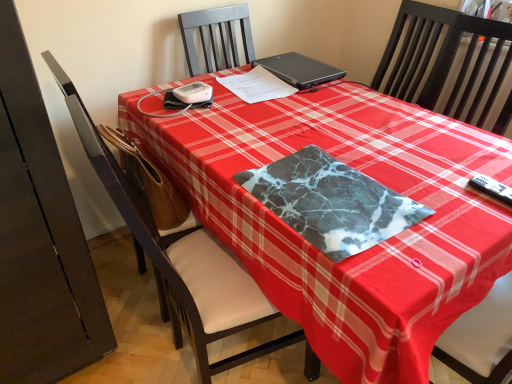
Question: Is black matte laptop at upper center a part of marble-like fabric at center?

Choices:
 (A) yes
 (B) no

Answer: (B)

Question: Is marble-like fabric at center oriented towards black matte laptop at upper center?

Choices:
 (A) no
 (B) yes

Answer: (A)

Question: Is marble-like fabric at center oriented away from black matte laptop at upper center?

Choices:
 (A) yes
 (B) no

Answer: (B)

Question: Does marble-like fabric at center have a lesser height compared to black matte laptop at upper center?

Choices:
 (A) yes
 (B) no

Answer: (A)

Question: Does marble-like fabric at center have a greater width compared to black matte laptop at upper center?

Choices:
 (A) no
 (B) yes

Answer: (A)

Question: Is black plastic remote control at lower right bigger or smaller than black wood chair at center?

Choices:
 (A) small
 (B) big

Answer: (A)

Question: In the image, is black plastic remote control at lower right on the left side or the right side of black wood chair at center?

Choices:
 (A) left
 (B) right

Answer: (A)

Question: From the image's perspective, relative to black wood chair at center, is black plastic remote control at lower right above or below?

Choices:
 (A) below
 (B) above

Answer: (A)

Question: Which is correct: black plastic remote control at lower right is inside black wood chair at center, or outside of it?

Choices:
 (A) inside
 (B) outside

Answer: (B)

Question: From the image's perspective, relative to black plastic remote control at lower right, is white paper at center above or below?

Choices:
 (A) above
 (B) below

Answer: (A)

Question: Is white paper at center situated inside black plastic remote control at lower right or outside?

Choices:
 (A) inside
 (B) outside

Answer: (B)

Question: From a real-world perspective, is white paper at center above or below black plastic remote control at lower right?

Choices:
 (A) above
 (B) below

Answer: (A)

Question: Looking at the image, does white paper at center seem bigger or smaller compared to black plastic remote control at lower right?

Choices:
 (A) big
 (B) small

Answer: (A)

Question: From the image's perspective, relative to marble-like fabric at center, is black matte laptop at upper center above or below?

Choices:
 (A) below
 (B) above

Answer: (B)

Question: From a real-world perspective, relative to marble-like fabric at center, is black matte laptop at upper center vertically above or below?

Choices:
 (A) above
 (B) below

Answer: (A)